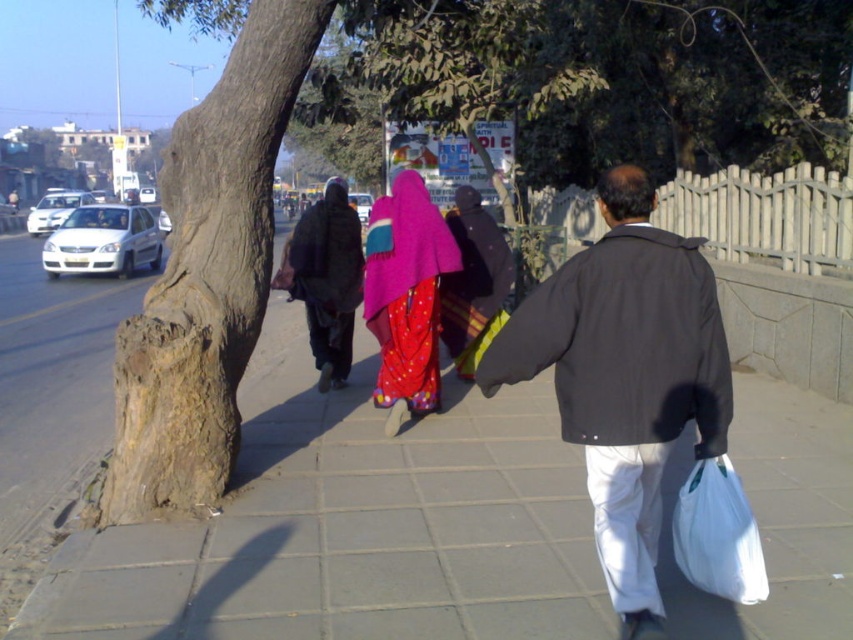
Question: Can you confirm if brown rough bark tree at left is positioned below dark gray jacket at center?

Choices:
 (A) yes
 (B) no

Answer: (B)

Question: Does gray concrete pavement at center come in front of shiny pink fabric at center?

Choices:
 (A) no
 (B) yes

Answer: (B)

Question: Among these points, which one is farthest from the camera?

Choices:
 (A) (187, 628)
 (B) (757, 564)

Answer: (A)

Question: Does gray concrete pavement at center have a lesser width compared to shiny pink fabric at center?

Choices:
 (A) no
 (B) yes

Answer: (B)

Question: Which is nearer to the gray concrete pavement at center?

Choices:
 (A) shiny pink fabric at center
 (B) brown rough bark tree at left

Answer: (A)

Question: Among these objects, which one is farthest from the camera?

Choices:
 (A) brown rough bark tree at left
 (B) gray concrete pavement at center
 (C) dark brown fabric at center

Answer: (C)